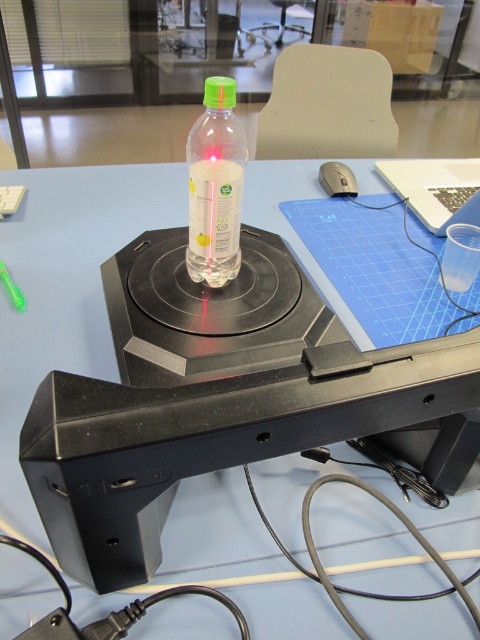
Who is more forward, [207,202] or [330,188]?

Point [207,202] is in front.

Between translucent plastic bottle at center and black plastic mouse at right, which one has less height?

black plastic mouse at right

What do you see at coordinates (215, 186) in the screenshot? This screenshot has height=640, width=480. I see `translucent plastic bottle at center` at bounding box center [215, 186].

Where is `translucent plastic bottle at center`? translucent plastic bottle at center is located at coordinates (215, 186).